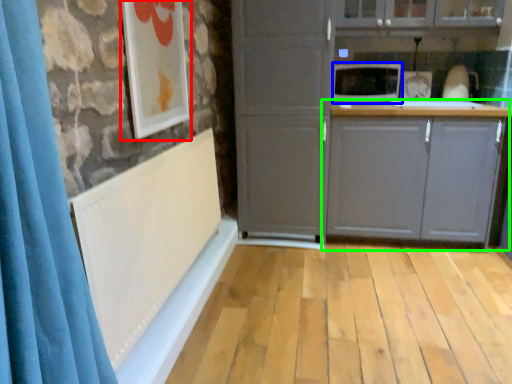
Question: Estimate the real-world distances between objects in this image. Which object is farther from picture frame (highlighted by a red box), microwave oven (highlighted by a blue box) or cabinetry (highlighted by a green box)?

Choices:
 (A) microwave oven
 (B) cabinetry

Answer: (B)